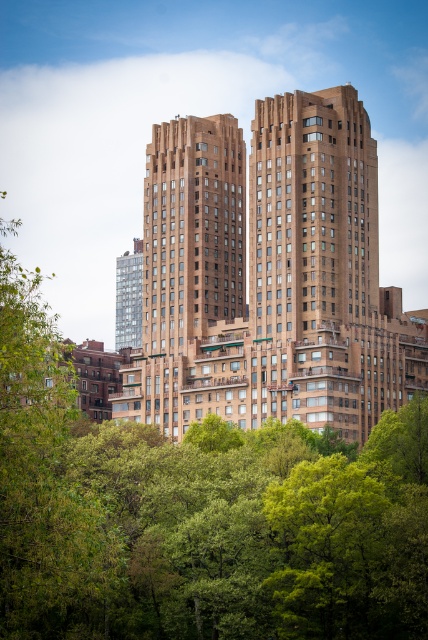
Question: Does green leafy tree at center have a larger size compared to green leafy tree at left?

Choices:
 (A) yes
 (B) no

Answer: (A)

Question: Does brown brick building at center come in front of green leafy tree at left?

Choices:
 (A) yes
 (B) no

Answer: (B)

Question: Which point is closer to the camera taking this photo?

Choices:
 (A) (56, 376)
 (B) (41, 548)

Answer: (B)

Question: Which object appears closest to the camera in this image?

Choices:
 (A) green leafy tree at center
 (B) green leafy tree at left
 (C) brown brick building at center

Answer: (A)

Question: Which of the following is the farthest from the observer?

Choices:
 (A) (85, 429)
 (B) (12, 602)

Answer: (A)

Question: Is green leafy tree at center below brown brick building at center?

Choices:
 (A) no
 (B) yes

Answer: (B)